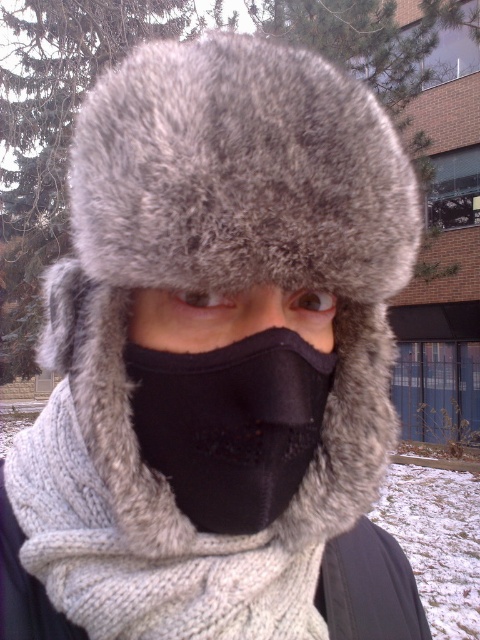
Does black fleece mask at center have a larger size compared to black matte nose at center?

Yes, black fleece mask at center is bigger than black matte nose at center.

Who is more distant from viewer, (129, 339) or (136, 301)?

The point (129, 339) is more distant.

Find the location of a particular element. The image size is (480, 640). black fleece mask at center is located at coordinates (228, 317).

Find the location of a particular element. The width and height of the screenshot is (480, 640). black fleece mask at center is located at coordinates (228, 317).